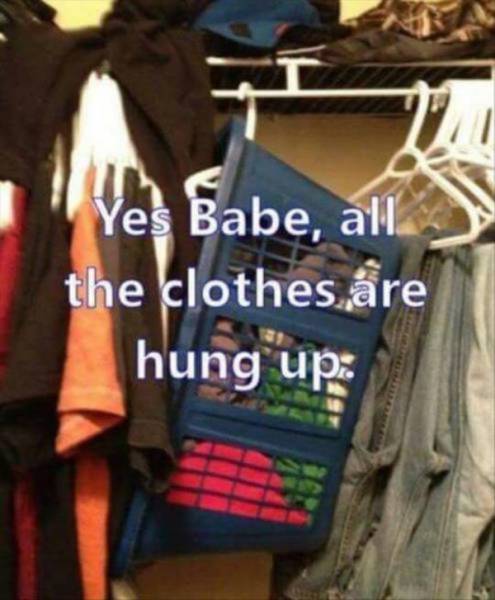
I want to click on hangers, so click(482, 135), click(456, 140), click(413, 136), click(250, 128).